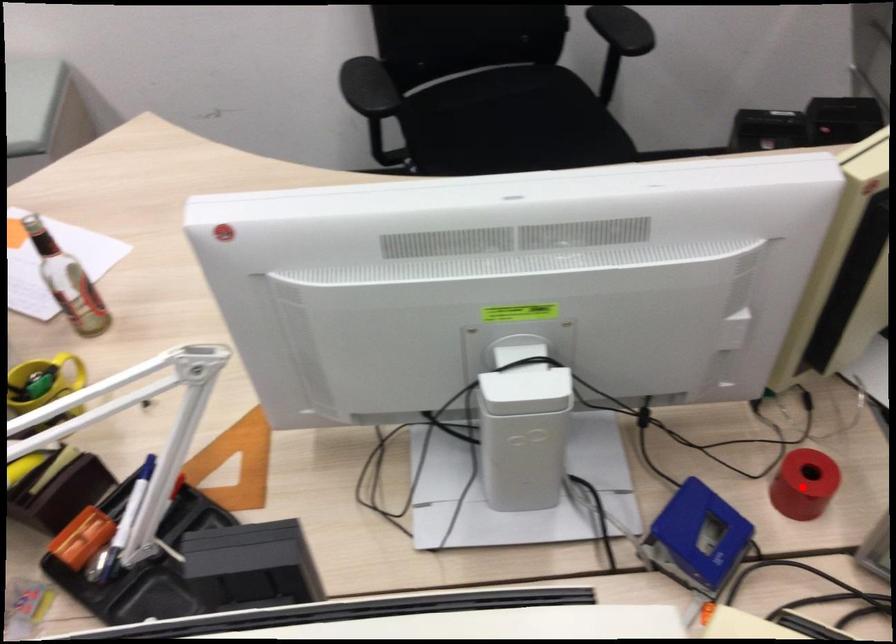
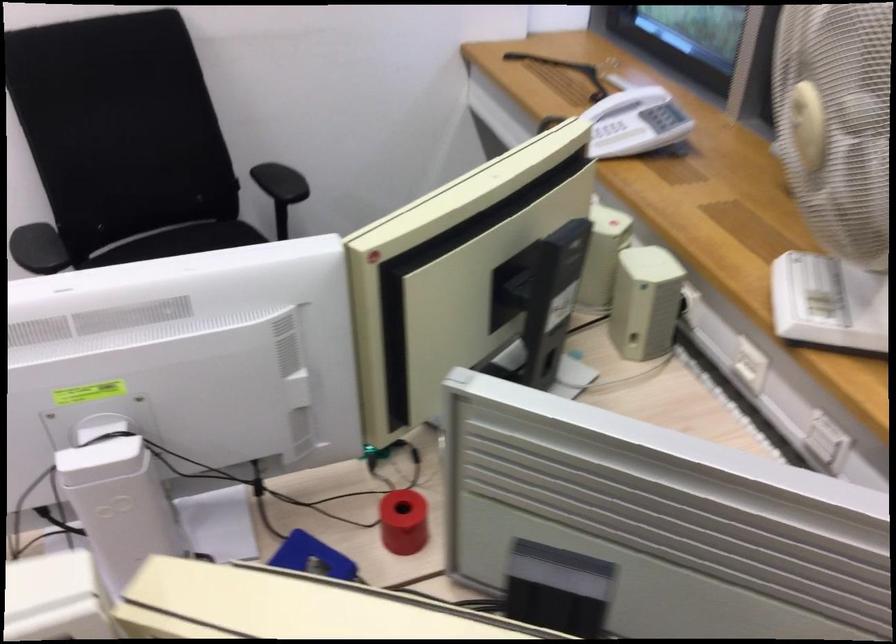
The point at the highlighted location is marked in the first image. Where is the corresponding point in the second image?

(403, 522)